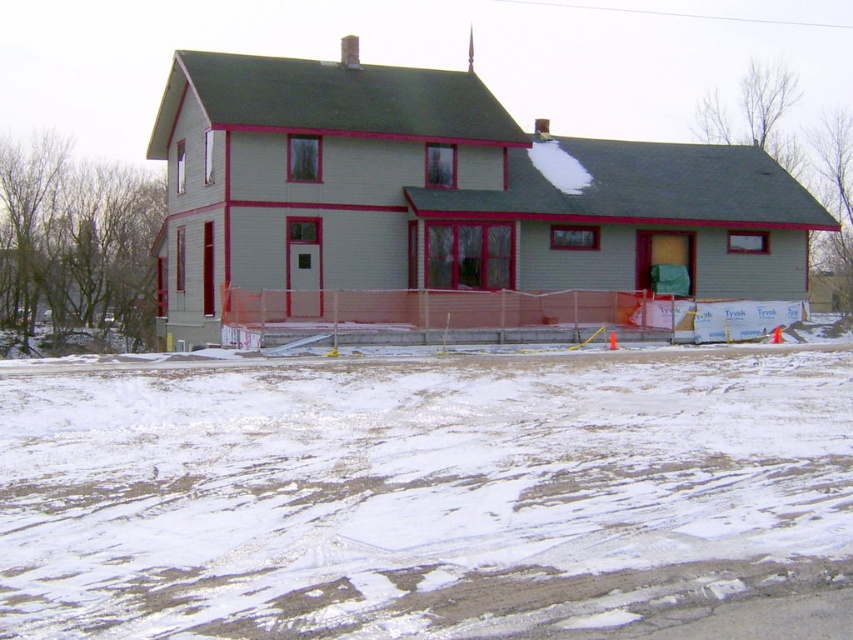
Does white powdery snow at lower center appear over light gray wood house at center?

No, white powdery snow at lower center is not above light gray wood house at center.

Does white powdery snow at lower center have a lesser height compared to light gray wood house at center?

Yes.

Is point (242, 492) positioned before point (190, 200)?

Yes, point (242, 492) is closer to viewer.

Identify the location of white powdery snow at lower center. The image size is (853, 640). (430, 497).